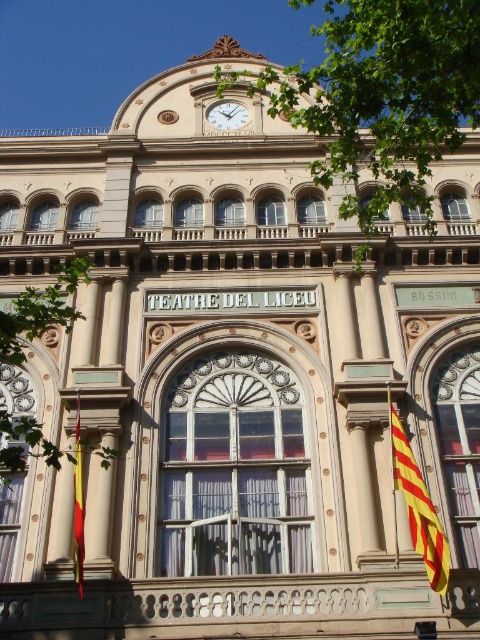
Question: Among these points, which one is farthest from the camera?

Choices:
 (A) (227, 122)
 (B) (439, 538)
 (C) (396, 116)

Answer: (A)

Question: Can you confirm if green leafy tree at left is positioned to the right of yellowmaterial/textureflag at lower right?

Choices:
 (A) yes
 (B) no

Answer: (B)

Question: Considering the relative positions of yellowmaterial/textureflag at lower right and yellow fabric flag at lower left in the image provided, where is yellowmaterial/textureflag at lower right located with respect to yellow fabric flag at lower left?

Choices:
 (A) below
 (B) above

Answer: (B)

Question: Based on their relative distances, which object is farther from the green leafy tree at upper center?

Choices:
 (A) green leafy tree at left
 (B) white marble clock at upper center
 (C) yellowmaterial/textureflag at lower right

Answer: (A)

Question: Which of the following is the farthest from the observer?

Choices:
 (A) (25, 442)
 (B) (396, 451)
 (C) (74, 552)
 (D) (239, 116)

Answer: (D)

Question: Can you confirm if green leafy tree at upper center is positioned to the right of white marble clock at upper center?

Choices:
 (A) no
 (B) yes

Answer: (B)